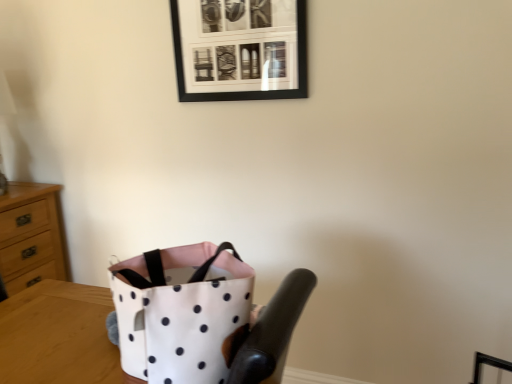
Describe the element at coordinates (30, 236) in the screenshot. The image size is (512, 384). I see `wooden chest of drawers at left` at that location.

Identify the location of white fabric bag at center. (58, 336).

The image size is (512, 384). Describe the element at coordinates (182, 312) in the screenshot. I see `white polka dot fabric bag at lower center` at that location.

What is the approximate width of white polka dot fabric bag at lower center?

14.33 inches.

Find the location of a particular element. wooden chest of drawers at left is located at coordinates (30, 236).

Does white polka dot fabric bag at lower center turn towards wooden chest of drawers at left?

No, white polka dot fabric bag at lower center is not aimed at wooden chest of drawers at left.

Can you confirm if white polka dot fabric bag at lower center is shorter than wooden chest of drawers at left?

Indeed, white polka dot fabric bag at lower center has a lesser height compared to wooden chest of drawers at left.

This screenshot has width=512, height=384. What are the coordinates of `handbag lying above the wooden chest of drawers at left (from the image's perspective)` in the screenshot? It's located at (182, 312).

How different are the orientations of white polka dot fabric bag at lower center and wooden chest of drawers at left in degrees?

The angular difference between white polka dot fabric bag at lower center and wooden chest of drawers at left is 179 degrees.

In terms of size, does wooden chest of drawers at left appear bigger or smaller than white polka dot fabric bag at lower center?

Considering their sizes, wooden chest of drawers at left takes up more space than white polka dot fabric bag at lower center.

Is wooden chest of drawers at left spatially inside white polka dot fabric bag at lower center, or outside of it?

wooden chest of drawers at left is spatially situated outside white polka dot fabric bag at lower center.

Considering the positions of point (35, 280) and point (184, 269), is point (35, 280) closer or farther from the camera than point (184, 269)?

Point (35, 280).

Considering the positions of objects wooden chest of drawers at left and white polka dot fabric bag at lower center in the image provided, who is behind, wooden chest of drawers at left or white polka dot fabric bag at lower center?

Positioned behind is wooden chest of drawers at left.

In the scene shown: Based on their positions, is white polka dot fabric bag at lower center located to the left or right of black matte picture frame at upper center?

From the image, it's evident that white polka dot fabric bag at lower center is to the left of black matte picture frame at upper center.

Is white polka dot fabric bag at lower center positioned with its back to black matte picture frame at upper center?

No.

Is white polka dot fabric bag at lower center completely or partially outside of black matte picture frame at upper center?

That's correct, white polka dot fabric bag at lower center is outside of black matte picture frame at upper center.

Which is closer to the camera, (213,357) or (208,35)?

The point (213,357) is more forward.

Is white fabric bag at center next to black matte picture frame at upper center?

No, white fabric bag at center is not next to black matte picture frame at upper center.

Where is `table on the left of black matte picture frame at upper center`? table on the left of black matte picture frame at upper center is located at coordinates (58, 336).

Which point is more forward, (49, 343) or (247, 13)?

The point (49, 343) is more forward.

Is white fabric bag at center facing away from black matte picture frame at upper center?

white fabric bag at center is not turned away from black matte picture frame at upper center.

Are wooden chest of drawers at left and black matte picture frame at upper center located far from each other?

wooden chest of drawers at left is positioned a significant distance from black matte picture frame at upper center.

Consider the image. Which of these two, wooden chest of drawers at left or black matte picture frame at upper center, stands shorter?

black matte picture frame at upper center.

From the image's perspective, would you say wooden chest of drawers at left is shown under black matte picture frame at upper center?

Yes, from the image's perspective, wooden chest of drawers at left is below black matte picture frame at upper center.

Considering the sizes of objects wooden chest of drawers at left and black matte picture frame at upper center in the image provided, who is smaller, wooden chest of drawers at left or black matte picture frame at upper center?

With smaller size is black matte picture frame at upper center.

Is white polka dot fabric bag at lower center to the right of white fabric bag at center from the viewer's perspective?

Correct, you'll find white polka dot fabric bag at lower center to the right of white fabric bag at center.

Which is behind, point (168, 351) or point (106, 369)?

The point (106, 369) is farther from the camera.

Based on the photo, how different are the orientations of white polka dot fabric bag at lower center and white fabric bag at center in degrees?

There is a 0.000149-degree angle between the facing directions of white polka dot fabric bag at lower center and white fabric bag at center.

From a real-world perspective, which object stands above the other?

white polka dot fabric bag at lower center.

Between wooden chest of drawers at left and white fabric bag at center, which one is positioned behind?

Positioned behind is wooden chest of drawers at left.

Considering the relative sizes of wooden chest of drawers at left and white fabric bag at center in the image provided, is wooden chest of drawers at left wider than white fabric bag at center?

No.

Is wooden chest of drawers at left aimed at white fabric bag at center?

No.

The height and width of the screenshot is (384, 512). There is a wooden chest of drawers at left. Identify the location of handbag above it (from a real-world perspective). (182, 312).

Locate an element on the screen. chest of drawers on the left of white polka dot fabric bag at lower center is located at coordinates (30, 236).

Based on their spatial positions, is white fabric bag at center or black matte picture frame at upper center closer to white polka dot fabric bag at lower center?

Based on the image, white fabric bag at center appears to be nearer to white polka dot fabric bag at lower center.

Considering their positions, is black matte picture frame at upper center positioned closer to white fabric bag at center than wooden chest of drawers at left?

Among the two, wooden chest of drawers at left is located nearer to white fabric bag at center.

When comparing their distances from wooden chest of drawers at left, does white polka dot fabric bag at lower center or white fabric bag at center seem further?

white polka dot fabric bag at lower center is positioned further to the anchor wooden chest of drawers at left.

Considering their positions, is wooden chest of drawers at left positioned closer to black matte picture frame at upper center than white polka dot fabric bag at lower center?

white polka dot fabric bag at lower center.

Estimate the real-world distances between objects in this image. Which object is closer to black matte picture frame at upper center, white polka dot fabric bag at lower center or white fabric bag at center?

white fabric bag at center lies closer to black matte picture frame at upper center than the other object.

Based on their spatial positions, is wooden chest of drawers at left or white fabric bag at center further from white polka dot fabric bag at lower center?

The object further to white polka dot fabric bag at lower center is wooden chest of drawers at left.

Based on their spatial positions, is wooden chest of drawers at left or black matte picture frame at upper center closer to white polka dot fabric bag at lower center?

Based on the image, black matte picture frame at upper center appears to be nearer to white polka dot fabric bag at lower center.

Considering their positions, is wooden chest of drawers at left positioned closer to white fabric bag at center than white polka dot fabric bag at lower center?

white polka dot fabric bag at lower center lies closer to white fabric bag at center than the other object.

Identify the location of handbag between black matte picture frame at upper center and white fabric bag at center in the vertical direction. Image resolution: width=512 pixels, height=384 pixels. (182, 312).

The width and height of the screenshot is (512, 384). Identify the location of table positioned between white polka dot fabric bag at lower center and wooden chest of drawers at left from near to far. (58, 336).

Find the location of a particular element. handbag between wooden chest of drawers at left and black matte picture frame at upper center is located at coordinates (182, 312).

This screenshot has width=512, height=384. What are the coordinates of `table located between wooden chest of drawers at left and black matte picture frame at upper center in the left-right direction` in the screenshot? It's located at (58, 336).